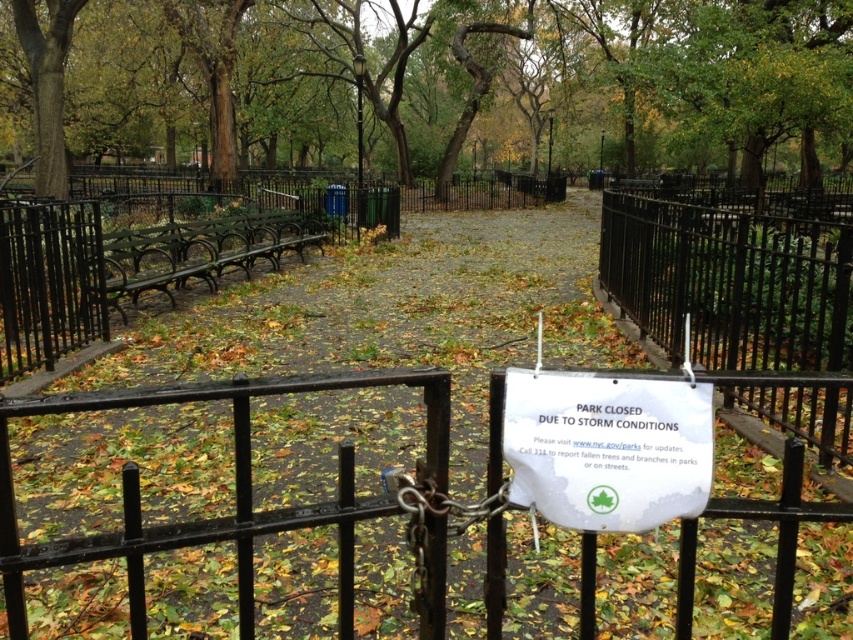
Question: Which point is closer to the camera?

Choices:
 (A) white paper sign at center
 (B) black wrought iron gate at center
 (C) brown wood tree at center

Answer: (B)

Question: Based on their relative distances, which object is nearer to the black wrought iron gate at center?

Choices:
 (A) brown wood tree at center
 (B) white paper sign at center
 (C) black wrought iron fence at right

Answer: (B)

Question: Is brown wood tree at center to the left of black wrought iron fence at right from the viewer's perspective?

Choices:
 (A) no
 (B) yes

Answer: (B)

Question: Which object is closer to the camera taking this photo?

Choices:
 (A) black wrought iron fence at right
 (B) black wrought iron gate at center

Answer: (B)

Question: Does brown wood tree at center appear on the right side of black wrought iron fence at right?

Choices:
 (A) yes
 (B) no

Answer: (B)

Question: Is black wrought iron gate at center bigger than white paper sign at center?

Choices:
 (A) yes
 (B) no

Answer: (A)